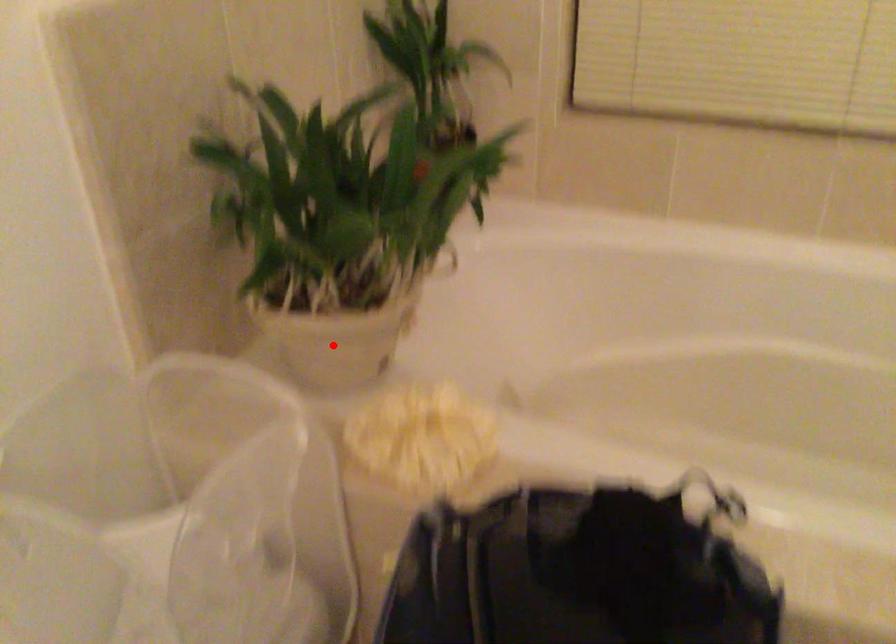
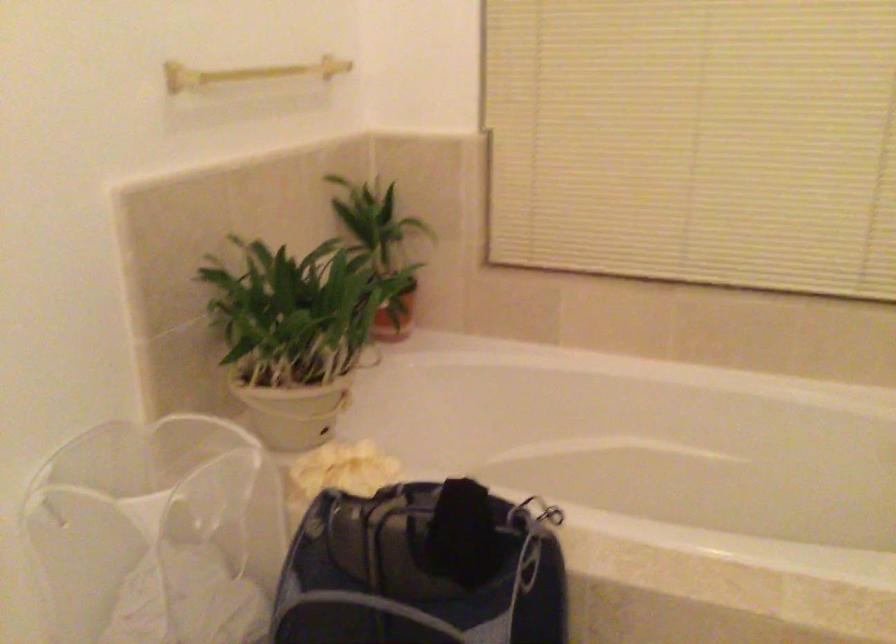
Question: I am providing you with two images of the same scene from different viewpoints. Given a red point in image1, look at the same physical point in image2. Is it:

Choices:
 (A) Closer to the viewpoint
 (B) Farther from the viewpoint

Answer: (B)